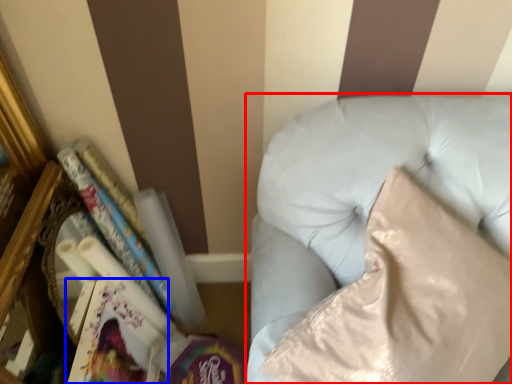
Question: Which of the following is the closest to the observer, furniture (highlighted by a red box) or paperback book (highlighted by a blue box)?

Choices:
 (A) furniture
 (B) paperback book

Answer: (A)